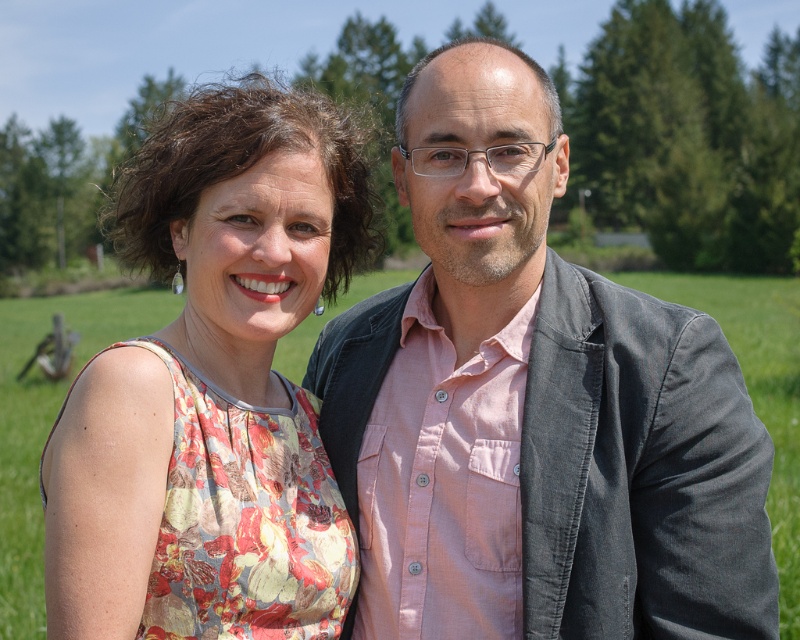
Question: Which of the following is the farthest from the observer?

Choices:
 (A) matte gray blazer at center
 (B) floral fabric dress at left

Answer: (A)

Question: Can you confirm if matte gray blazer at center is positioned below floral fabric dress at left?

Choices:
 (A) no
 (B) yes

Answer: (B)

Question: Which point is farther from the camera taking this photo?

Choices:
 (A) (38, 538)
 (B) (386, 621)
 (C) (248, 474)

Answer: (A)

Question: Can you confirm if matte gray blazer at center is wider than floral fabric dress at left?

Choices:
 (A) no
 (B) yes

Answer: (B)

Question: Which point is closer to the camera taking this photo?

Choices:
 (A) (746, 353)
 (B) (522, 406)
 (C) (308, 259)

Answer: (B)

Question: Is floral fabric dress at left wider than floral fabric dress at center?

Choices:
 (A) no
 (B) yes

Answer: (A)